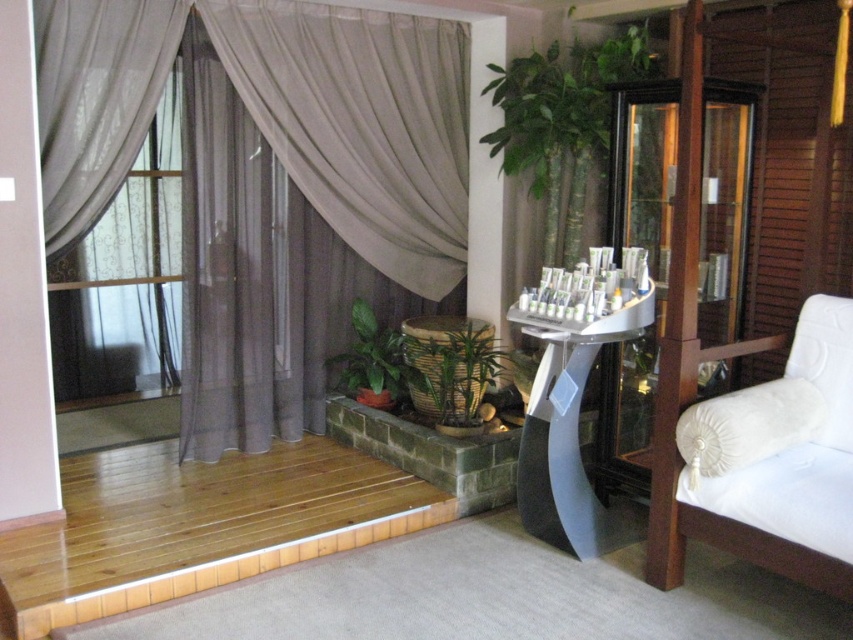
Does green leafy plant at upper center have a lesser height compared to green woven basket at center?

In fact, green leafy plant at upper center may be taller than green woven basket at center.

Does green leafy plant at upper center have a larger size compared to green woven basket at center?

Indeed, green leafy plant at upper center has a larger size compared to green woven basket at center.

Between point (515, 84) and point (380, 403), which one is positioned behind?

Point (380, 403)

Where is `green leafy plant at upper center`? Image resolution: width=853 pixels, height=640 pixels. green leafy plant at upper center is located at coordinates (560, 102).

Who is lower down, white fabric pillow at right or braided wicker basket at center?

white fabric pillow at right

Is point (722, 419) farther from viewer compared to point (415, 340)?

No.

Find the location of a particular element. Image resolution: width=853 pixels, height=640 pixels. white fabric pillow at right is located at coordinates pos(747,426).

Can you confirm if white fabric pillow at right is positioned to the left of green woven basket at center?

Incorrect, white fabric pillow at right is not on the left side of green woven basket at center.

Is point (735, 397) less distant than point (387, 352)?

Yes, it is.

Is point (743, 394) positioned in front of point (358, 317)?

Yes, point (743, 394) is in front of point (358, 317).

Identify the location of white fabric pillow at right. Image resolution: width=853 pixels, height=640 pixels. (747, 426).